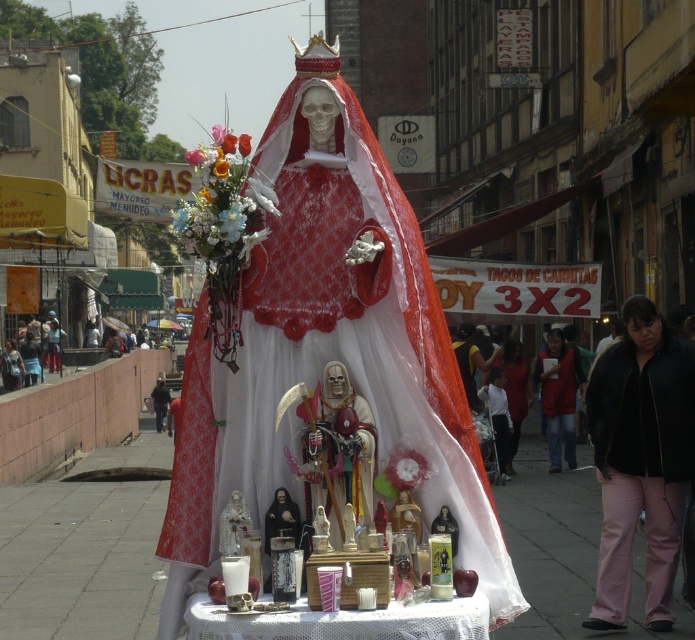
You are an artist planning to sketch the scene. You need to decide which object to draw first based on their widths. According to the scene, which object should you sketch first, the matte red fabric altar at center or the red fabric vest at center?

The matte red fabric altar at center is thinner than the red fabric vest at center, so you should sketch the red fabric vest at center first since it is wider and might form the base of the composition.

You are a photographer standing at the edge of the altar. You want to capture a photo of the white lace tablecloth at center while also including the pink fabric pants at lower right in the frame. Given the distance between them, do you think you can fit both in the same photo without moving closer or farther?

The pink fabric pants at lower right is 4.48 meters from the white lace tablecloth at center. Since the distance between them is significant, you might need a wide angle lens to capture both in the same frame without moving. However, standard lenses may struggle with this distance unless the camera is positioned strategically to include both elements.

You are a photographer standing in front of the altar. You want to take a photo that includes both the point at coordinates point (639, 500) and point (384, 625). Which point is closer to the camera so you can ensure both are in focus?

Point (384, 625) is closer to the camera than point (639, 500), so you should focus on that point to ensure both are in focus.